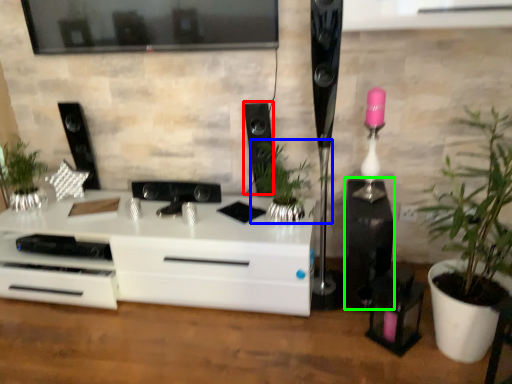
Question: Based on their relative distances, which object is farther from speaker (highlighted by a red box)? Choose from houseplant (highlighted by a blue box) and speaker (highlighted by a green box).

Choices:
 (A) houseplant
 (B) speaker

Answer: (B)